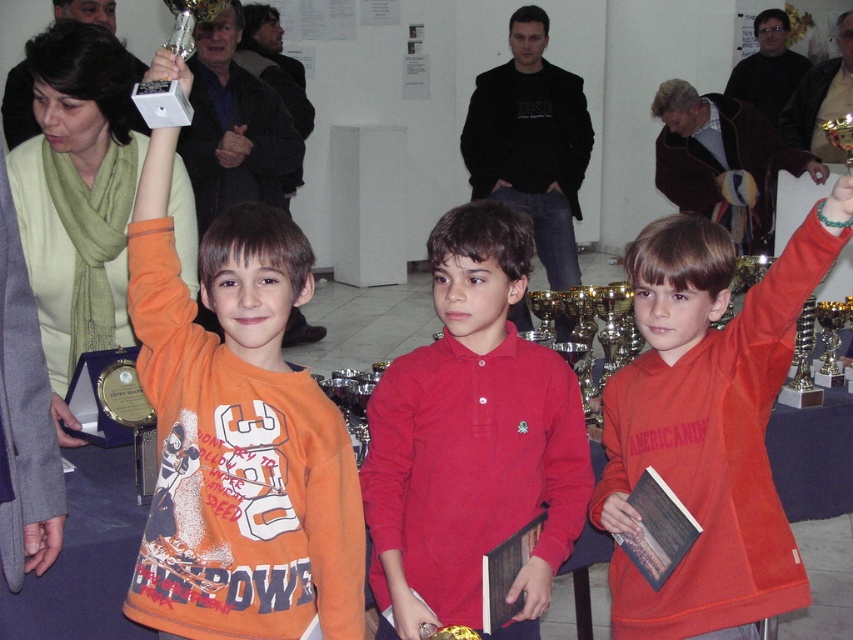
Looking at this image, based on the scene description, can you determine which object is placed higher between the red matte shirt at center and the green beaded bracelet at upper center?

The green beaded bracelet at upper center is placed higher than the red matte shirt at center.

You are a photographer who needs to capture a clear shot of both the red matte shirt at center and the metallic trophy at upper left. Based on their sizes in the image, which one should you focus on first to ensure it appears larger in the photo?

The red matte shirt at center is much taller than the metallic trophy at upper left, so focusing on it first will ensure it appears larger in the photo.